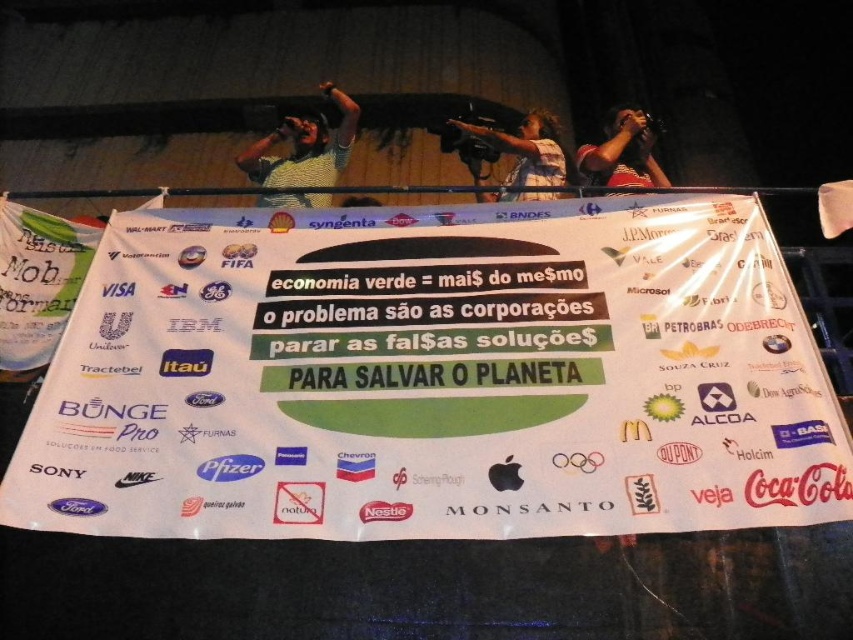
You are an activist trying to deliver a speech at a protest. You see the white paper banner at center and the striped shirt at upper center in the scene. Which object is closer to the speaker standing at the front of the stage?

The striped shirt at upper center is closer to the speaker standing at the front of the stage because it is positioned above the white paper banner at center.

You are a photographer setting up for an event. You need to ensure that the white paper banner at center is visible to all attendees. Considering the blue denim shirt at upper center, which object is wider and might block the view of the banner?

The white paper banner at center is wider than the blue denim shirt at upper center, so it is less likely to block the view of the banner. However, since the banner is at center and the shirt is at upper center, the shirt might be positioned above the banner and could potentially block part of the top section if not adjusted properly.